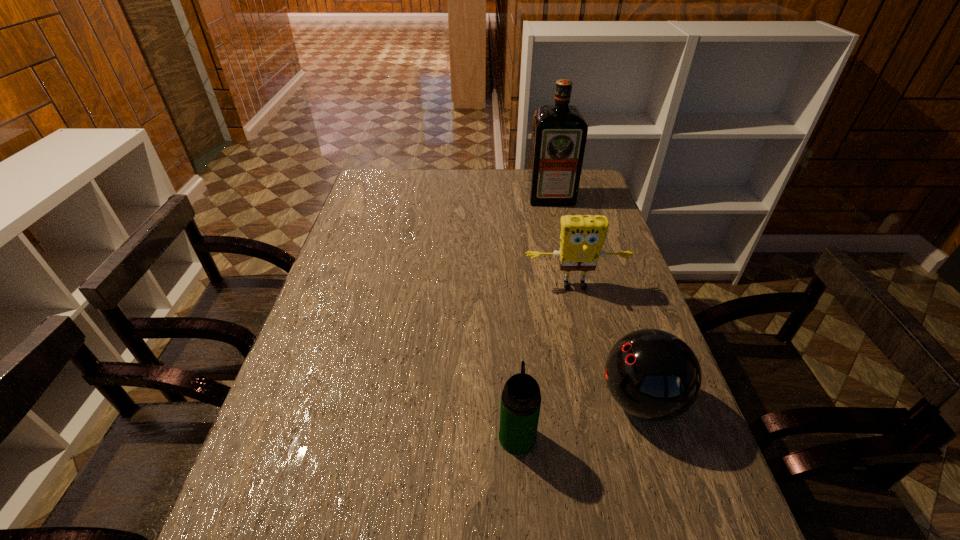
At what (x,y) coordinates should I click in order to perform the action: click on free space that is in between the bowling ball and the second farthest object. Please return your answer as a coordinate pair (x, y). Looking at the image, I should click on 608,343.

Locate an element on the screen. empty space between the leftmost object and the third nearest object is located at coordinates (546, 362).

Select which object is the second closest to the bowling ball. Please provide its 2D coordinates. Your answer should be formatted as a tuple, i.e. [(x, y)], where the tuple contains the x and y coordinates of a point satisfying the conditions above.

[(581, 239)]

Find the location of a particular element. This screenshot has width=960, height=540. object that can be found as the second closest to the leftmost object is located at coordinates (581, 239).